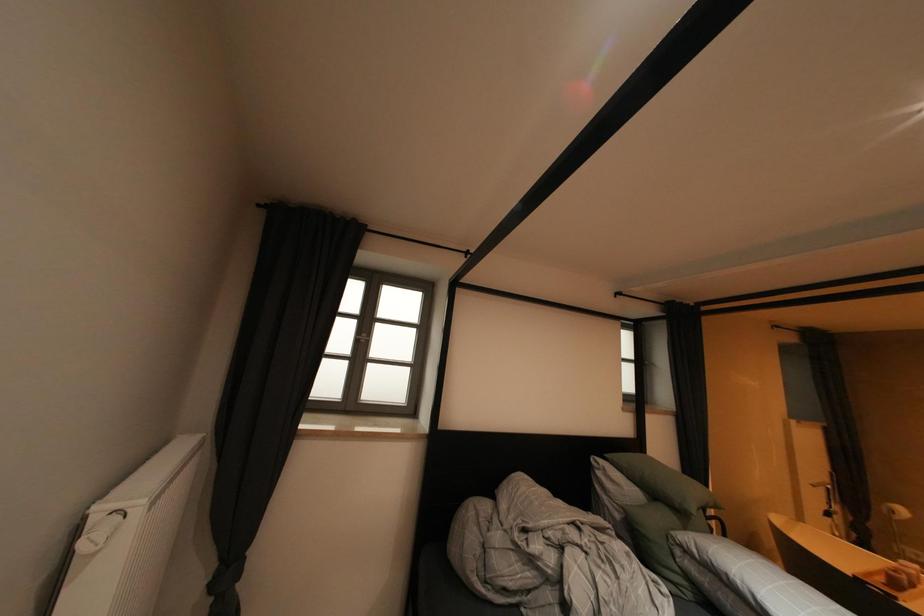
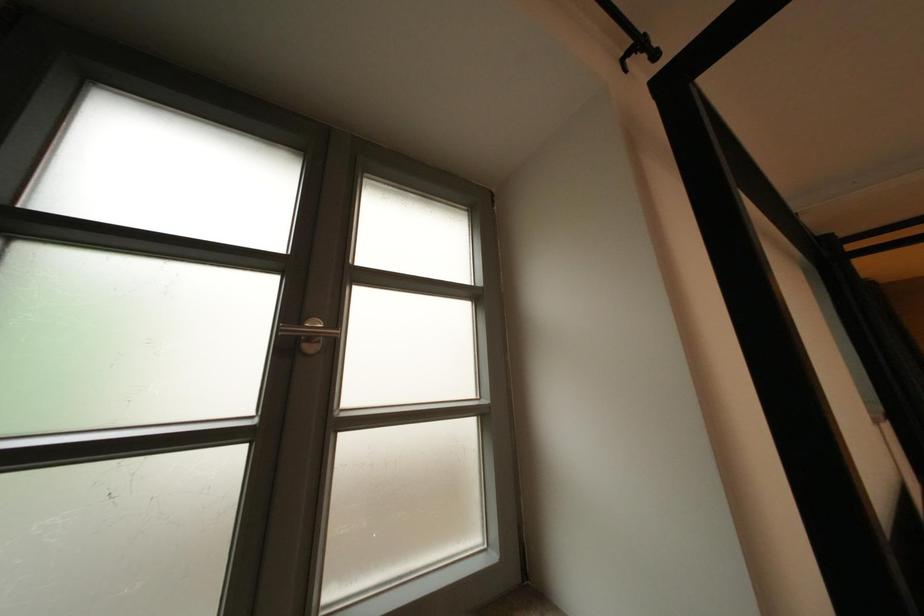
Which direction would the cameraman need to move to produce the second image?

The cameraman walked toward left, forward.